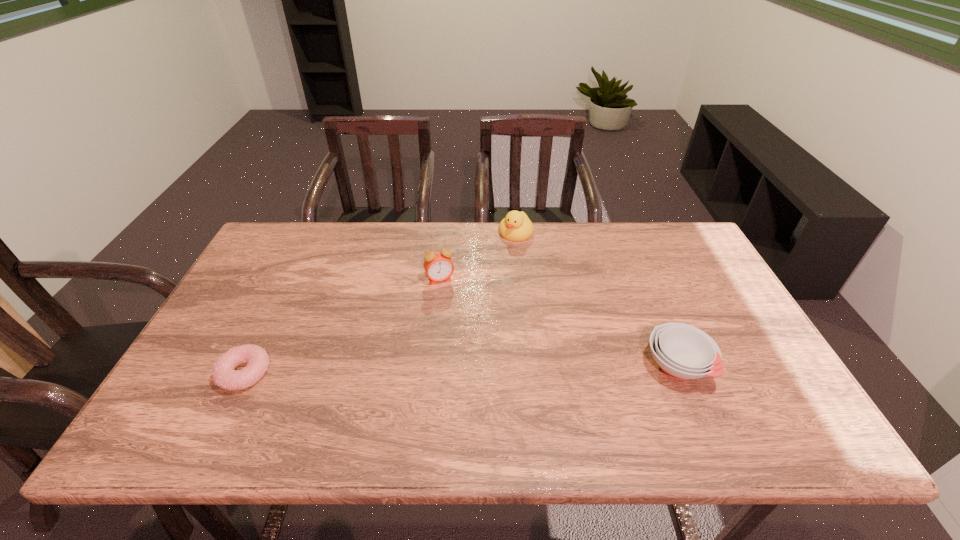
Where is `object situated at the right edge`? object situated at the right edge is located at coordinates (683, 352).

Identify the location of object present at the near left corner. The image size is (960, 540). (224, 375).

Locate an element on the screen. object that is at the near right corner is located at coordinates (683, 352).

This screenshot has height=540, width=960. In the image, there is a desktop. What are the coordinates of `vacant space at the far edge` in the screenshot? It's located at tap(336, 256).

Image resolution: width=960 pixels, height=540 pixels. In the image, there is a desktop. What are the coordinates of `free space at the near edge` in the screenshot? It's located at (323, 397).

I want to click on free region at the left edge of the desktop, so click(252, 295).

Where is `vacant space at the far left corner of the desktop`? Image resolution: width=960 pixels, height=540 pixels. vacant space at the far left corner of the desktop is located at coordinates (301, 224).

Find the location of a particular element. This screenshot has width=960, height=540. free space at the near left corner is located at coordinates [185, 407].

You are a GUI agent. You are given a task and a screenshot of the screen. Output one action in this format:
    pyautogui.click(x=<x>, y=<y>)
    Task: Click on the vacant space at the near right corner
    
    Given the screenshot: What is the action you would take?
    pyautogui.click(x=780, y=401)

Find the location of a particular element. free spot between the second object from right to left and the leftmost object is located at coordinates (380, 303).